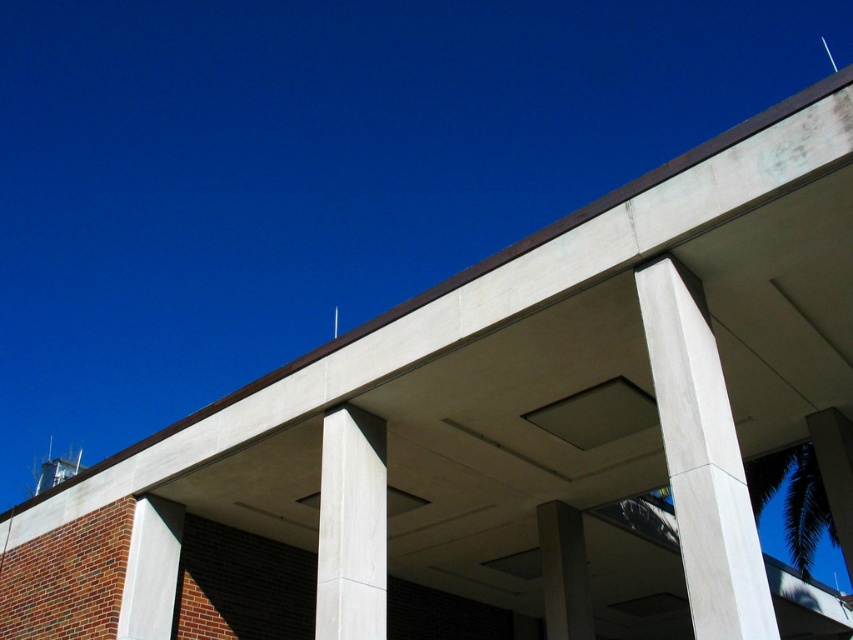
Question: Which point is farther to the camera?

Choices:
 (A) (579, 593)
 (B) (318, 525)
 (C) (752, 628)

Answer: (A)

Question: In this image, where is white smooth concrete pillar at center located relative to smooth concrete pillar at center?

Choices:
 (A) below
 (B) above

Answer: (B)

Question: Is white smooth concrete pillar at center to the right of white concrete column at center from the viewer's perspective?

Choices:
 (A) yes
 (B) no

Answer: (A)

Question: Is white smooth concrete pillar at center below smooth concrete pillar at center?

Choices:
 (A) yes
 (B) no

Answer: (B)

Question: Which of these objects is positioned closest to the white concrete column at center?

Choices:
 (A) smooth concrete pillar at center
 (B) white smooth concrete pillar at center

Answer: (B)

Question: Which point is closer to the camera?

Choices:
 (A) (550, 515)
 (B) (367, 577)
 (C) (700, 500)

Answer: (C)